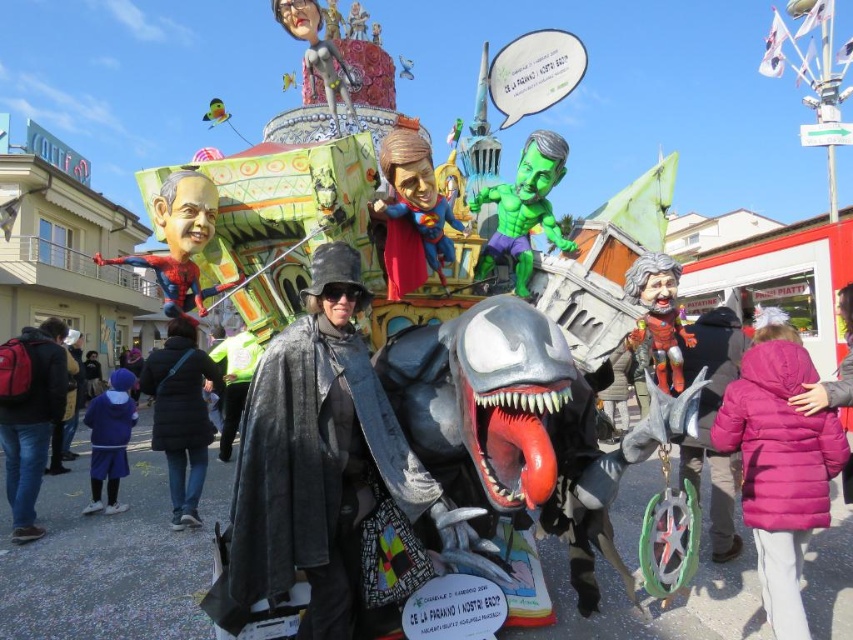
You are standing at the origin point of the coordinate system in the image. The float is located at the center of the image. Where is the denim jacket at lower left relative to the float?

The denim jacket at lower left is located at coordinate point (x=28, y=416), which is to the lower left of the float at the center.